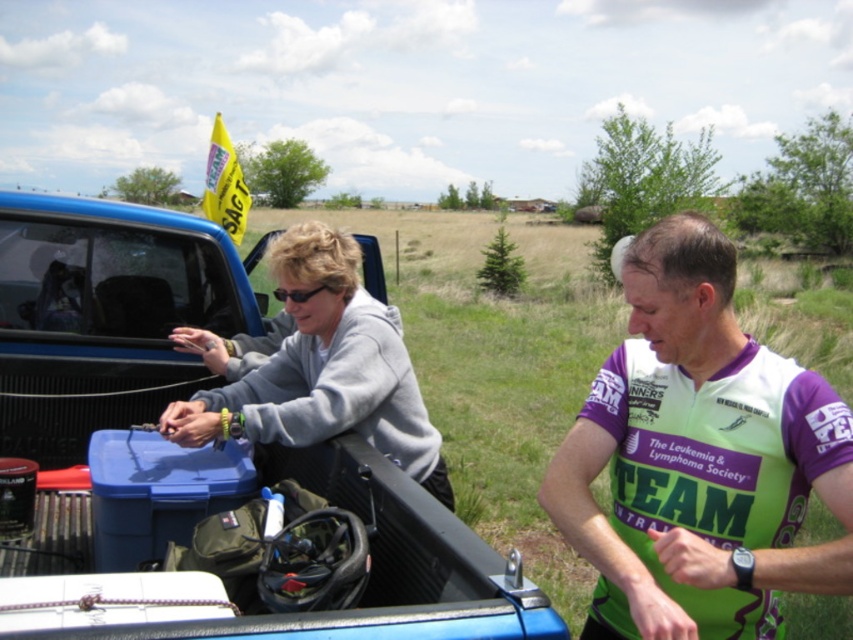
Which is above, green jersey at right or gray matte jacket at upper left?

gray matte jacket at upper left

Does green jersey at right appear on the left side of gray matte jacket at upper left?

No, green jersey at right is not to the left of gray matte jacket at upper left.

The width and height of the screenshot is (853, 640). In order to click on green jersey at right in this screenshot , I will do `click(699, 458)`.

Locate an element on the screen. Image resolution: width=853 pixels, height=640 pixels. green jersey at right is located at coordinates (699, 458).

Who is positioned more to the right, blue matte truck bed at center or gray matte jacket at upper left?

Positioned to the right is gray matte jacket at upper left.

Identify the location of blue matte truck bed at center. This screenshot has height=640, width=853. (195, 458).

Which is above, blue matte truck bed at center or green jersey at right?

green jersey at right

Between blue matte truck bed at center and green jersey at right, which one appears on the right side from the viewer's perspective?

green jersey at right

The width and height of the screenshot is (853, 640). Identify the location of blue matte truck bed at center. (195, 458).